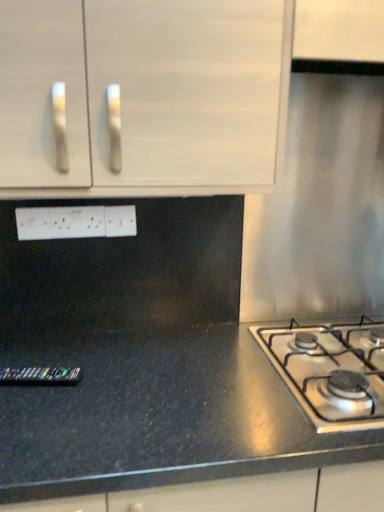
Locate an element on the screen. This screenshot has height=512, width=384. free space above black granite countertop at lower left (from a real-world perspective) is located at coordinates (217, 376).